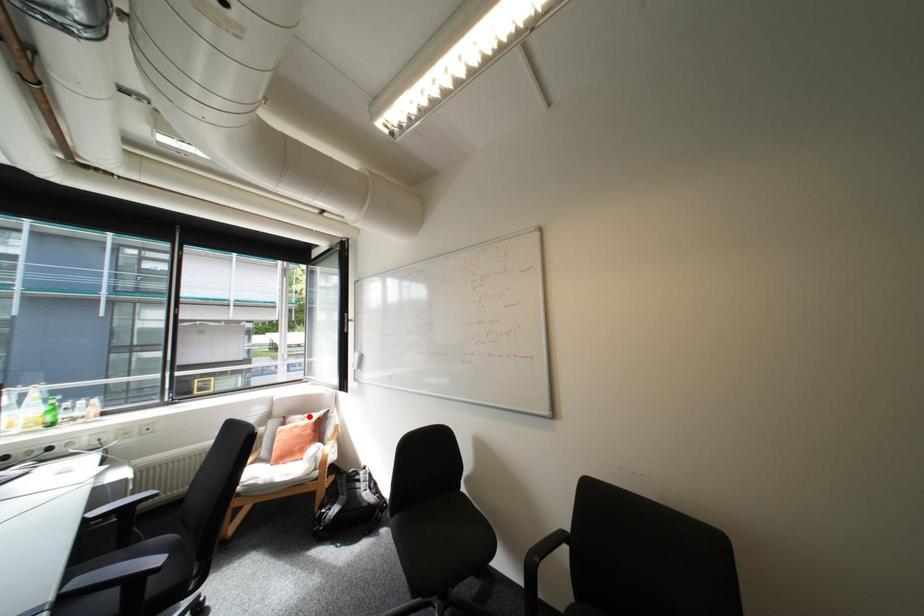
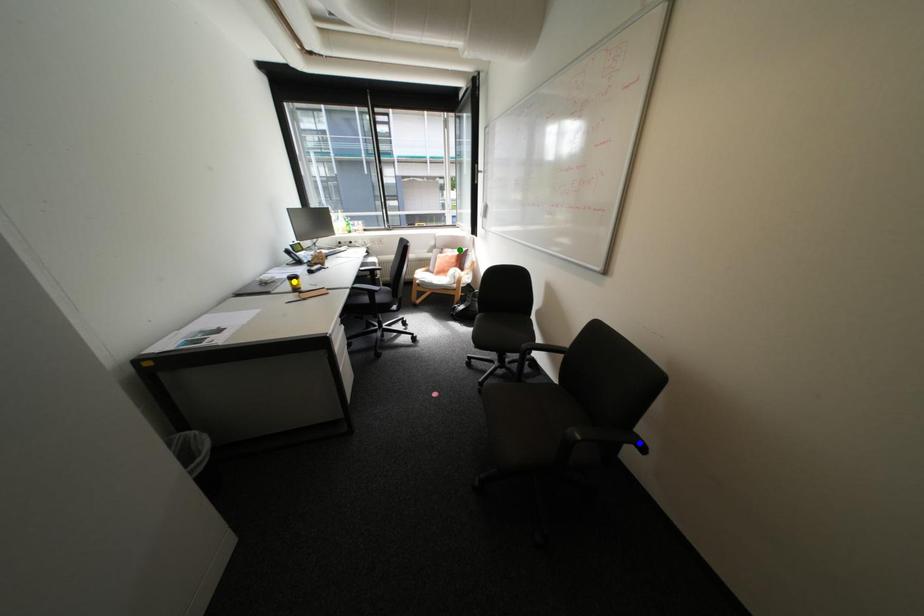
Question: I am providing you with two images of the same scene from different viewpoints. A red point is marked on the first image. You are given multiple points on the second image. In image 2, which mark is for the same physical point as the one in image 1?

Choices:
 (A) green point
 (B) yellow point
 (C) blue point

Answer: (A)